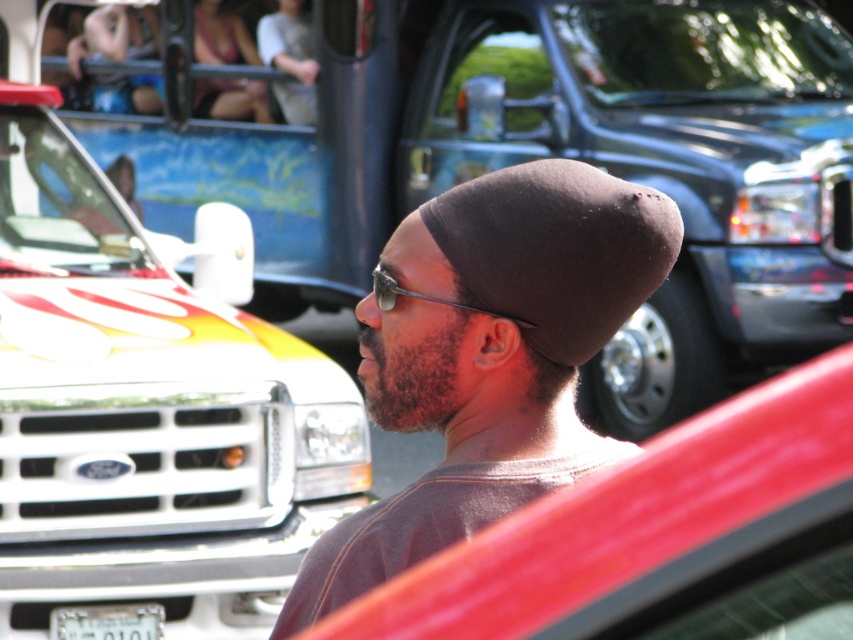
From the picture: You are a photographer at a car show and notice the matte black beanie at center and the white plastic license plate at lower center in your frame. Which object is positioned higher in the image?

The matte black beanie at center is located above the white plastic license plate at lower center, so it is positioned higher in the image.

You are standing in a car show and see the matte black beanie at center and the matte black car at center. Which one is positioned to the left?

The matte black beanie at center is positioned to the left of the matte black car at center.

You are a photographer at a car show and want to take a photo of both the white glossy pickup truck at center and the matte black car at center. The camera you are using has a minimum distance requirement of 2 meters between subjects to ensure both are in focus. Based on the scene, will both vehicles be in focus in your photo?

The white glossy pickup truck at center and the matte black car at center are 1.92 meters apart from each other. Since the required minimum distance is 2 meters, the camera cannot keep both in focus as the distance is less than required.